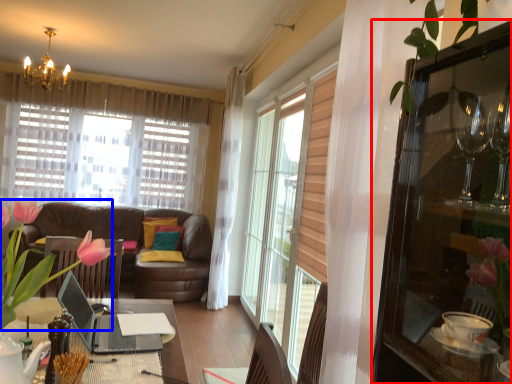
Question: Among these objects, which one is farthest to the camera, cabinetry (highlighted by a red box) or floral arrangement (highlighted by a blue box)?

Choices:
 (A) cabinetry
 (B) floral arrangement

Answer: (B)